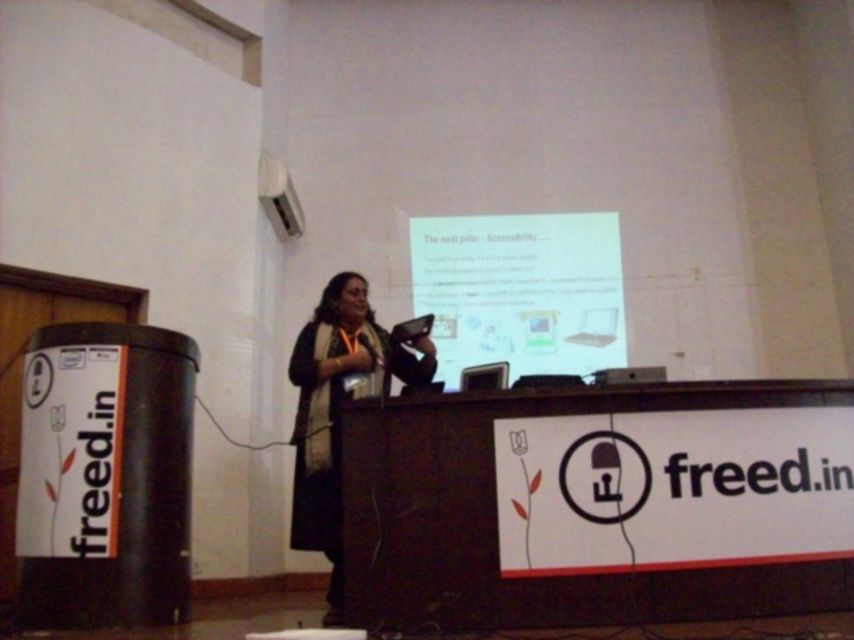
You are an attendee sitting in the front row of the conference room. You notice the white glossy projector screen at upper center and the black fabric at center. Which object is closer to you?

The white glossy projector screen at upper center is closer to you because the black fabric at center is behind it.

You are an attendee sitting in the front row of the conference room. You notice the white glossy projector screen at upper center and the black fabric at center. Which object is positioned to the right side of the other?

The white glossy projector screen at upper center is to the right of the black fabric at center.